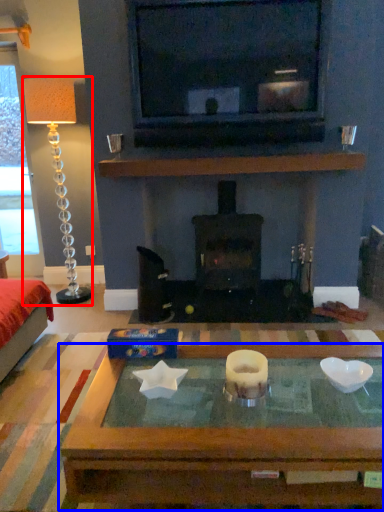
Question: Which object is closer to the camera taking this photo, lamp (highlighted by a red box) or coffee table (highlighted by a blue box)?

Choices:
 (A) lamp
 (B) coffee table

Answer: (B)